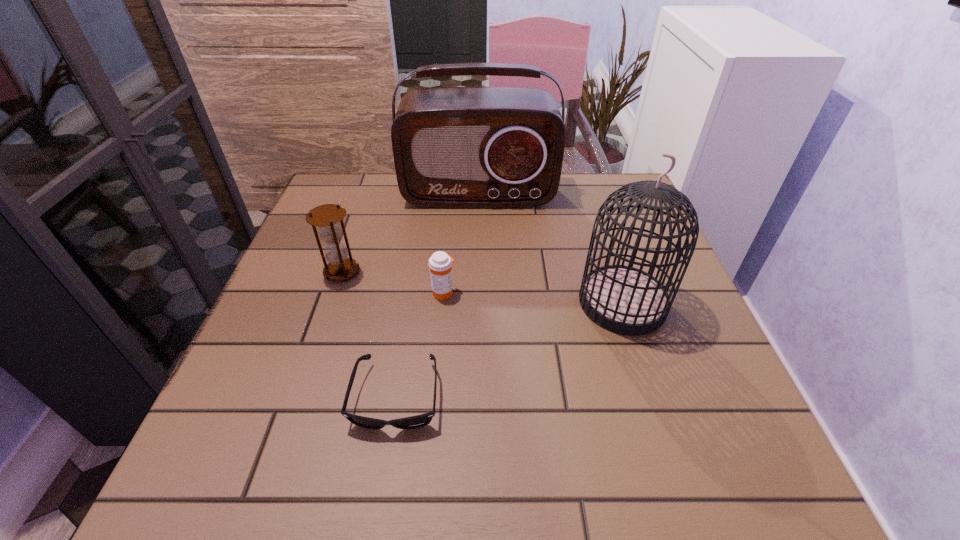
Locate an element on the screen. Image resolution: width=960 pixels, height=540 pixels. object that stands as the third closest to the birdcage is located at coordinates (413, 422).

You are a GUI agent. You are given a task and a screenshot of the screen. Output one action in this format:
    pyautogui.click(x=<x>, y=<y>)
    Task: Click on the object that stands as the third closest to the birdcage
    
    Given the screenshot: What is the action you would take?
    pyautogui.click(x=413, y=422)

Locate an element on the screen. free spot that satisfies the following two spatial constraints: 1. on the front side of the birdcage; 2. on the left side of the medicine is located at coordinates (443, 302).